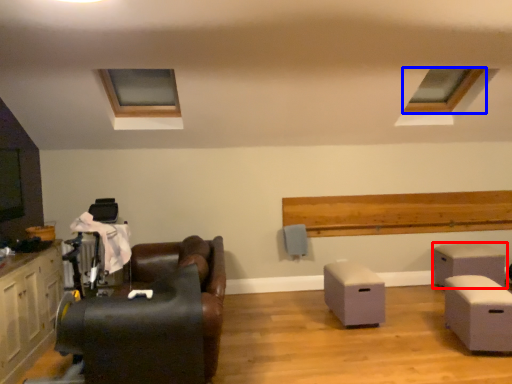
Question: Among these objects, which one is farthest to the camera, table (highlighted by a red box) or window (highlighted by a blue box)?

Choices:
 (A) table
 (B) window

Answer: (A)